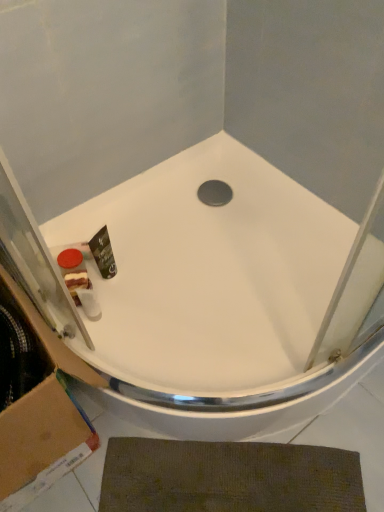
Question: Considering the relative sizes of brown cardboard at lower left and white glossy bathtub at center in the image provided, is brown cardboard at lower left wider than white glossy bathtub at center?

Choices:
 (A) yes
 (B) no

Answer: (B)

Question: Is brown cardboard at lower left taller than white glossy bathtub at center?

Choices:
 (A) yes
 (B) no

Answer: (A)

Question: Does brown cardboard at lower left have a lesser height compared to white glossy bathtub at center?

Choices:
 (A) yes
 (B) no

Answer: (B)

Question: From a real-world perspective, does brown cardboard at lower left stand above white glossy bathtub at center?

Choices:
 (A) no
 (B) yes

Answer: (B)

Question: Is brown cardboard at lower left oriented towards white glossy bathtub at center?

Choices:
 (A) yes
 (B) no

Answer: (B)

Question: Is brown cardboard at lower left turned away from white glossy bathtub at center?

Choices:
 (A) yes
 (B) no

Answer: (B)

Question: From a real-world perspective, is brown cardboard at lower left physically below matte plastic soap at lower left?

Choices:
 (A) no
 (B) yes

Answer: (A)

Question: Is brown cardboard at lower left bigger than matte plastic soap at lower left?

Choices:
 (A) no
 (B) yes

Answer: (B)

Question: Considering the relative positions of brown cardboard at lower left and matte plastic soap at lower left in the image provided, is brown cardboard at lower left in front of matte plastic soap at lower left?

Choices:
 (A) no
 (B) yes

Answer: (B)

Question: Can you confirm if brown cardboard at lower left is wider than matte plastic soap at lower left?

Choices:
 (A) no
 (B) yes

Answer: (B)

Question: Is brown cardboard at lower left at the left side of matte plastic soap at lower left?

Choices:
 (A) no
 (B) yes

Answer: (B)

Question: Does brown cardboard at lower left have a lesser height compared to matte plastic soap at lower left?

Choices:
 (A) no
 (B) yes

Answer: (A)

Question: Considering the relative sizes of matte plastic soap at lower left and brown textured bath mat at lower center in the image provided, is matte plastic soap at lower left smaller than brown textured bath mat at lower center?

Choices:
 (A) no
 (B) yes

Answer: (B)